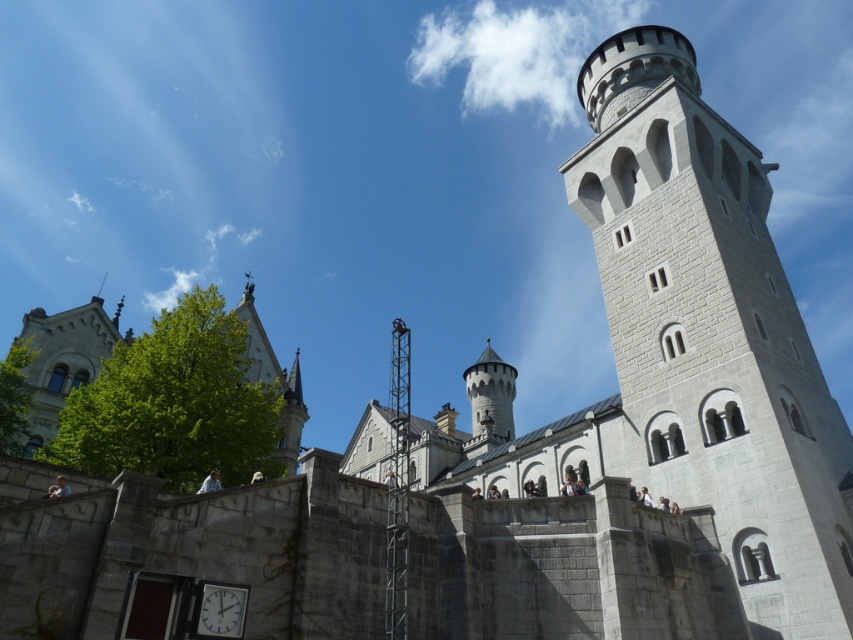
Is white stone tower at upper right above white plastic clock at lower center?

Yes.

Identify the location of white stone tower at upper right. (711, 333).